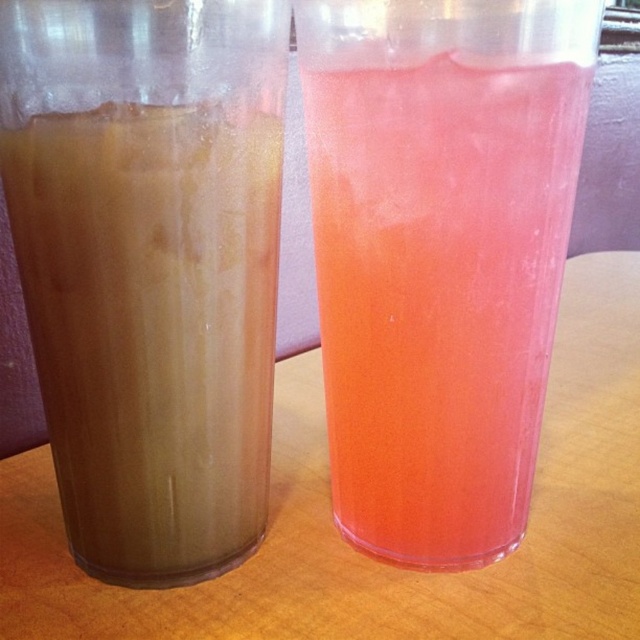
Question: Does translucent orange juice at right appear on the left side of brown translucent cup at left?

Choices:
 (A) no
 (B) yes

Answer: (A)

Question: Can you confirm if translucent orange juice at right is wider than brown translucent cup at left?

Choices:
 (A) no
 (B) yes

Answer: (B)

Question: Which point is farther to the camera?

Choices:
 (A) (184, 392)
 (B) (525, 182)

Answer: (A)

Question: Can you confirm if translucent orange juice at right is positioned to the right of brown translucent cup at left?

Choices:
 (A) yes
 (B) no

Answer: (A)

Question: Among these objects, which one is farthest from the camera?

Choices:
 (A) brown translucent cup at left
 (B) translucent orange juice at right

Answer: (B)